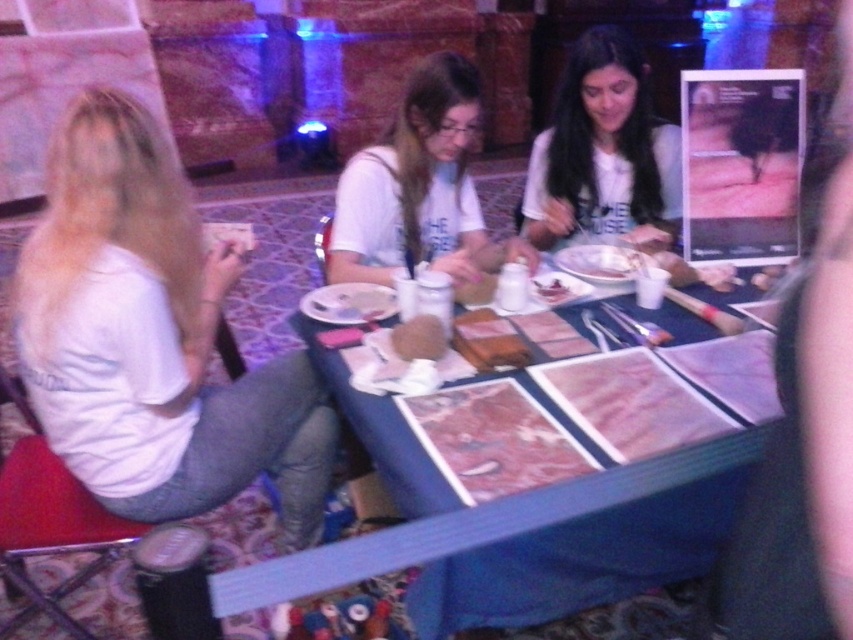
You are a photographer trying to capture a group photo of the people at the table. You notice two white shirts among them, the white matte shirt at left and the white cotton shirt at center. Which shirt should you focus on to ensure it stands out more in the photo due to its size?

The white matte shirt at left is larger in size than the white cotton shirt at center, so focusing on the white matte shirt at left would make it stand out more in the photo due to its size.